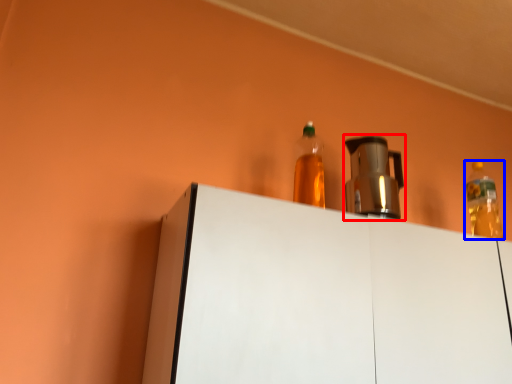
Question: Which object appears closest to the camera in this image, appliance (highlighted by a red box) or bottle (highlighted by a blue box)?

Choices:
 (A) appliance
 (B) bottle

Answer: (A)